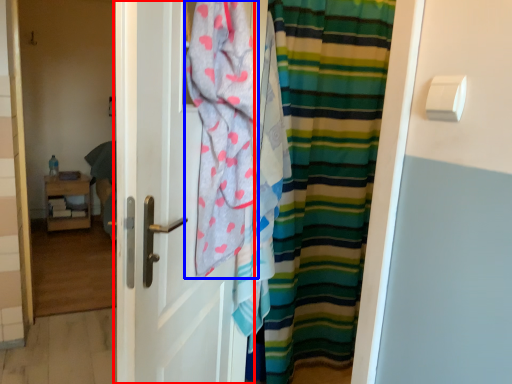
Question: Which object is further to the camera taking this photo, door (highlighted by a red box) or beach towel (highlighted by a blue box)?

Choices:
 (A) door
 (B) beach towel

Answer: (B)